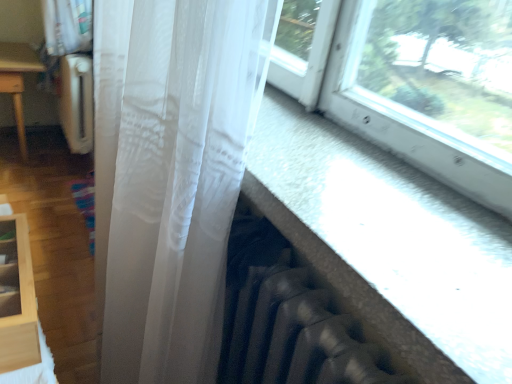
Question: Visually, is translucent white curtain at center positioned to the left or to the right of light wood shelf at lower left?

Choices:
 (A) right
 (B) left

Answer: (A)

Question: From the image's perspective, is translucent white curtain at center positioned above or below light wood shelf at lower left?

Choices:
 (A) below
 (B) above

Answer: (A)

Question: Which object is positioned farthest from the translucent white curtain at center?

Choices:
 (A) transparent fabric at lower right
 (B) light wood shelf at lower left

Answer: (B)

Question: Which is farther from the transparent fabric at lower right?

Choices:
 (A) translucent white curtain at center
 (B) light wood shelf at lower left

Answer: (B)